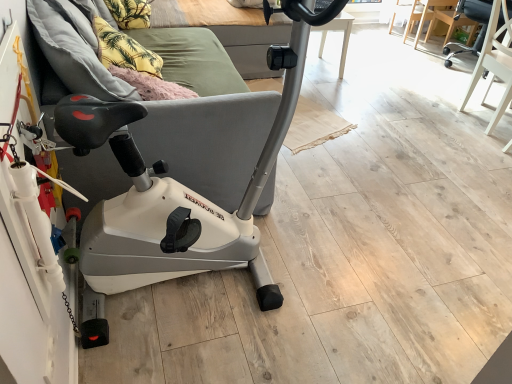
Question: Considering the relative positions of yellow fabric pillow at upper left, the 2th pillow when ordered from front to back, and yellow fabric pillow at upper left, the first pillow when ordered from bottom to top, in the image provided, is yellow fabric pillow at upper left, the 2th pillow when ordered from front to back, to the left or to the right of yellow fabric pillow at upper left, the first pillow when ordered from bottom to top,?

Choices:
 (A) right
 (B) left

Answer: (B)

Question: Is point (141, 26) positioned closer to the camera than point (134, 49)?

Choices:
 (A) closer
 (B) farther

Answer: (B)

Question: Which object is positioned farthest from the wooden table at center?

Choices:
 (A) white plastic stationary bicycle at left
 (B) black leather swivel chair at upper right, which is the 2th swivel chair in back-to-front order
 (C) yellow fabric pillow at upper left, the 2th pillow when ordered from front to back
 (D) yellow fabric pillow at upper left, which appears as the 2th pillow when viewed from the top
 (E) matte black chair at upper right, the 1th chair when ordered from right to left

Answer: (A)

Question: Which object is the closest to the yellow fabric pillow at upper left, acting as the 2th pillow starting from the bottom?

Choices:
 (A) matte black chair at upper right, the 1th chair when ordered from right to left
 (B) white plastic stationary bicycle at left
 (C) wooden table at center
 (D) black leather swivel chair at upper right, which is the 2th swivel chair in back-to-front order
 (E) black leather swivel chair at upper right, placed as the 1th swivel chair when sorted from back to front

Answer: (B)